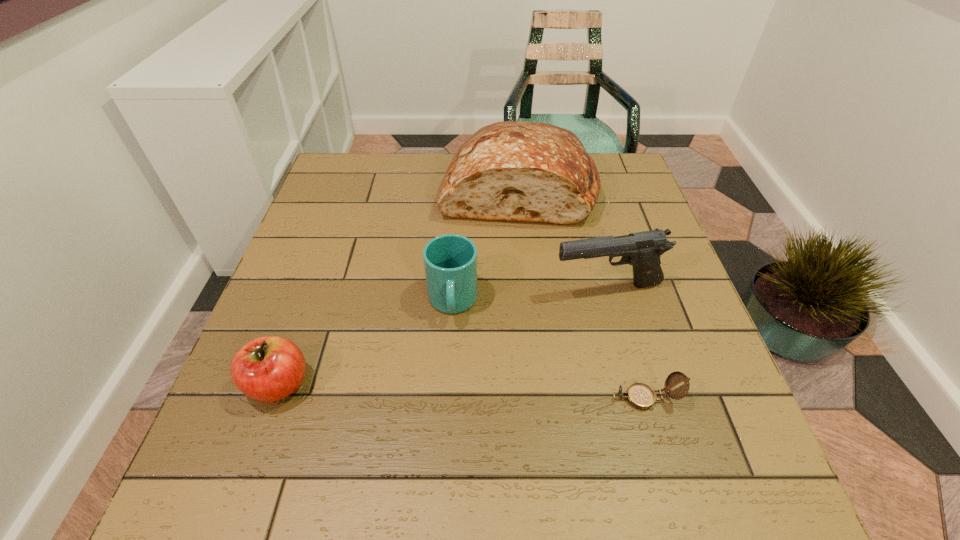
I want to click on the second shortest object, so click(x=267, y=369).

The width and height of the screenshot is (960, 540). In order to click on apple in this screenshot , I will do `click(267, 369)`.

The width and height of the screenshot is (960, 540). Find the location of `the shortest object`. the shortest object is located at coordinates (639, 395).

Identify the location of the second tallest object. (642, 250).

The image size is (960, 540). In order to click on the farthest object in this screenshot , I will do `click(520, 171)`.

Find the location of `the tallest object`. the tallest object is located at coordinates (520, 171).

Identify the location of cup. Image resolution: width=960 pixels, height=540 pixels. (450, 261).

Locate an element on the screen. vacant space located 0.190m on the back of the fourth tallest object is located at coordinates (313, 287).

At what (x,y) coordinates should I click in order to perform the action: click on free space located 0.070m on the face of the compass. Please return your answer as a coordinate pair (x, y). The width and height of the screenshot is (960, 540). Looking at the image, I should click on (574, 398).

At what (x,y) coordinates should I click in order to perform the action: click on vacant point located on the face of the compass. Please return your answer as a coordinate pair (x, y). The width and height of the screenshot is (960, 540). Looking at the image, I should click on (474, 398).